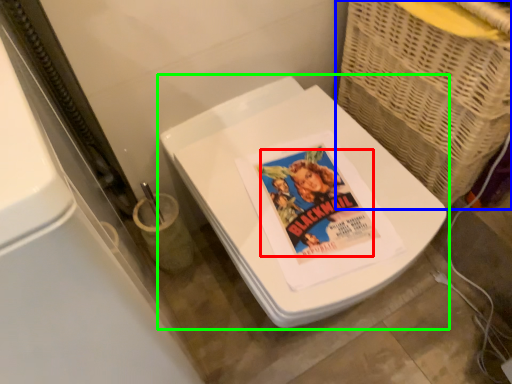
Question: Estimate the real-world distances between objects in this image. Which object is closer to comic book character (highlighted by a red box), basket (highlighted by a blue box) or toilet (highlighted by a green box)?

Choices:
 (A) basket
 (B) toilet

Answer: (B)